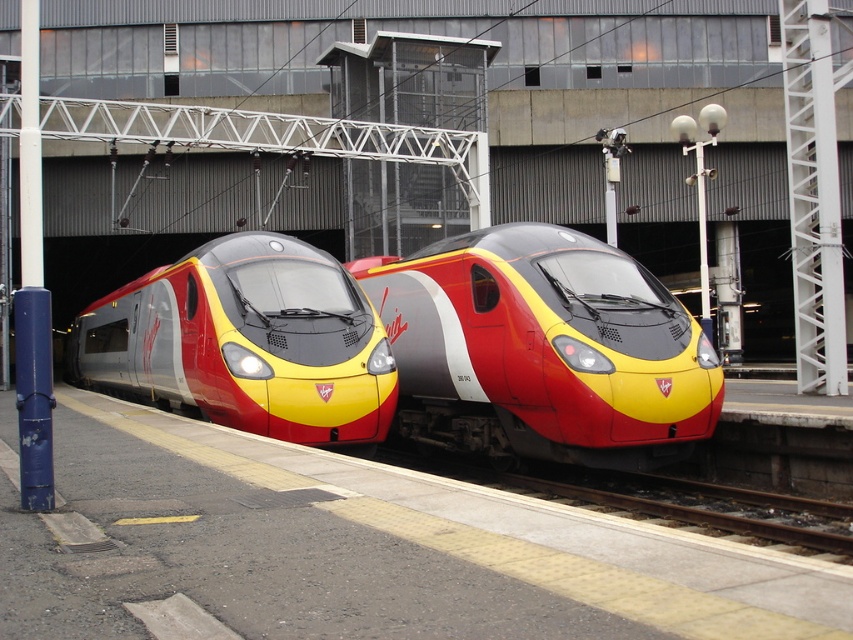
You are a passenger at the station and want to board the matte red and yellow train at center. According to the platform layout, where exactly should you stand to board the train?

The matte red and yellow train at center is located at point (543, 349), so you should stand at that coordinate to board the train.

Consider the image. You are a passenger waiting at the train station and see two trains, the matte red and yellow train at center and the matte metallic train at center. Which train is closer to the platform edge?

The matte metallic train at center is closer to the platform edge because the matte red and yellow train at center is positioned on its right side, meaning the metallic train is near the edge while the red and yellow one is further inward.